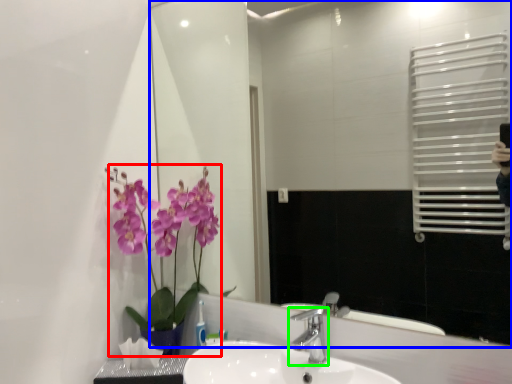
Question: Based on their relative distances, which object is nearer to floral arrangement (highlighted by a red box)? Choose from mirror (highlighted by a blue box) and tap (highlighted by a green box).

Choices:
 (A) mirror
 (B) tap

Answer: (B)